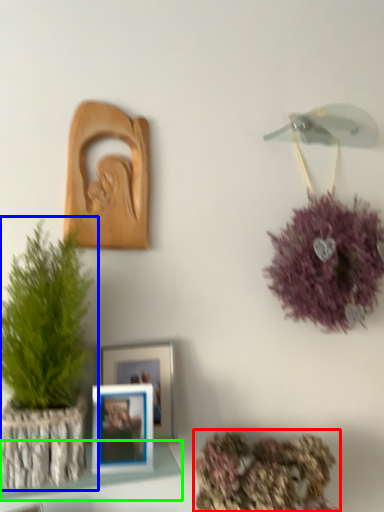
Question: Which object is the farthest from floral arrangement (highlighted by a red box)? Choose among these: houseplant (highlighted by a blue box) or shelf (highlighted by a green box).

Choices:
 (A) houseplant
 (B) shelf

Answer: (A)